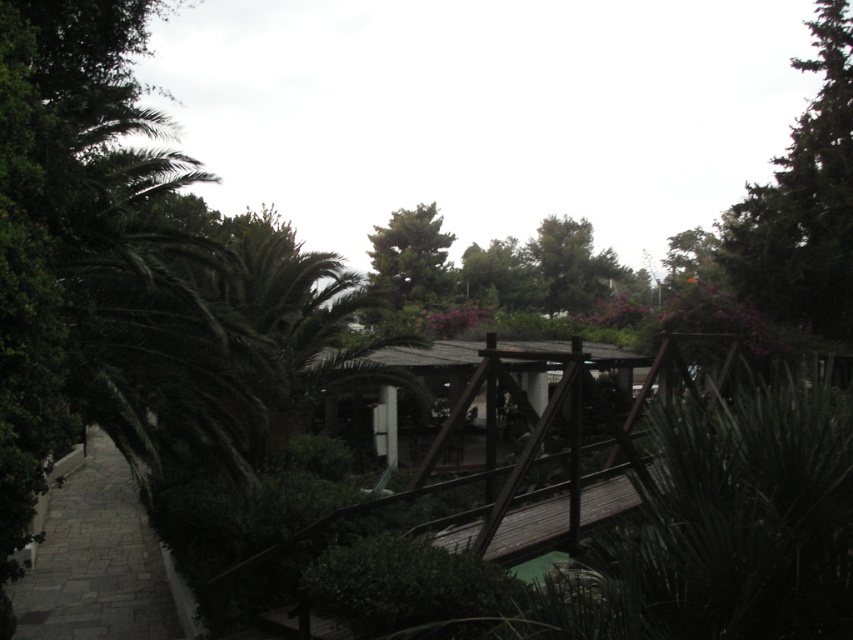
You are standing on the wooden bridge and want to walk to the gray stone path at lower left. Which direction should you go relative to the green leafy tree at upper center?

The gray stone path at lower left is in front of the green leafy tree at upper center, so you should walk towards the direction facing away from the tree to reach the path.

You are standing at the center of the wooden bridge and want to reach the gray stone path at lower left. Which direction should you walk to get there?

You should walk towards the lower left direction to reach the gray stone path at lower left.

You are a gardener planning to walk from the gray stone path at lower left to the green leafy tree at upper center. Considering the width of both, which path or tree has a larger width?

The gray stone path at lower left has a larger width than the green leafy tree at upper center.